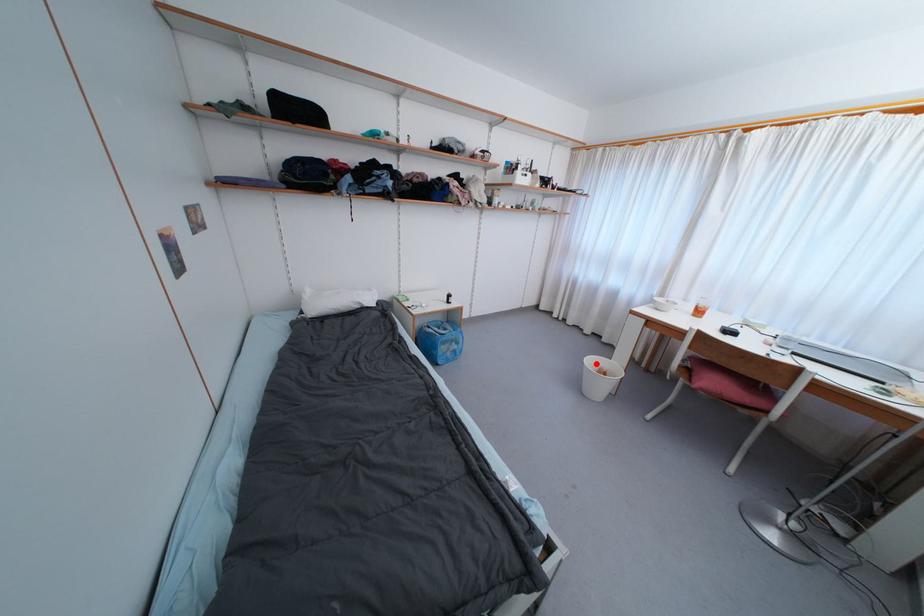
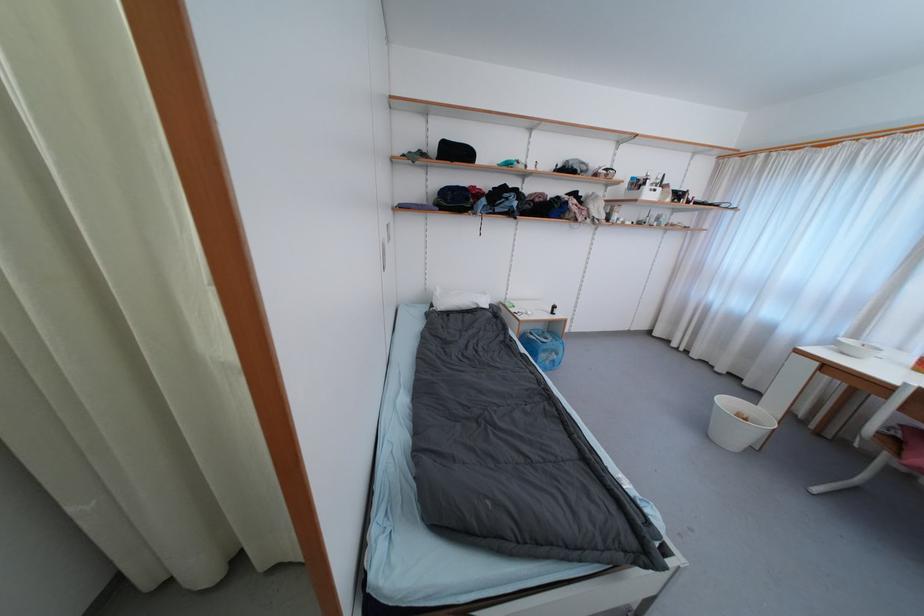
Question: A red point is marked in image1. In image2, is the corresponding 3D point closer to the camera or farther? Reply with the corresponding letter.

Choices:
 (A) The corresponding 3D point is closer.
 (B) The corresponding 3D point is farther.

Answer: (B)